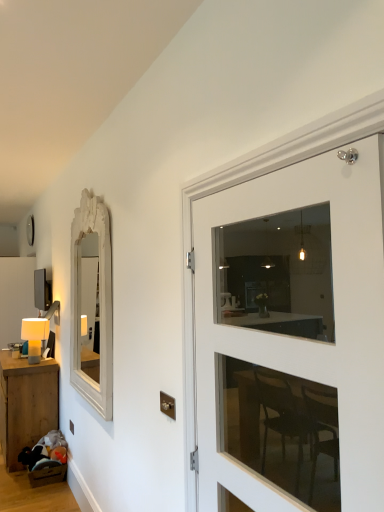
Question: Is matte white table lamp at left taller or shorter than white carved wood mirror at left?

Choices:
 (A) tall
 (B) short

Answer: (B)

Question: Is matte white table lamp at left bigger or smaller than white carved wood mirror at left?

Choices:
 (A) small
 (B) big

Answer: (A)

Question: Estimate the real-world distances between objects in this image. Which object is farther from the matte white table lamp at left?

Choices:
 (A) white glass door at right
 (B) white carved wood mirror at left
 (C) wooden table at lower left

Answer: (A)

Question: Which is farther from the wooden table at lower left?

Choices:
 (A) white glass door at right
 (B) matte white table lamp at left
 (C) white carved wood mirror at left

Answer: (A)